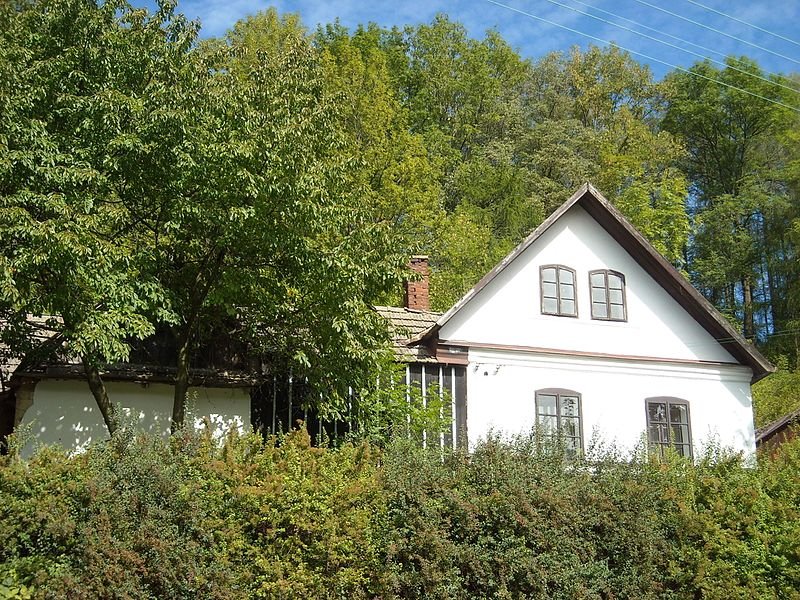
The image size is (800, 600). What are the coordinates of `window` in the screenshot? It's located at [x=560, y=293], [x=610, y=299], [x=669, y=422], [x=542, y=414].